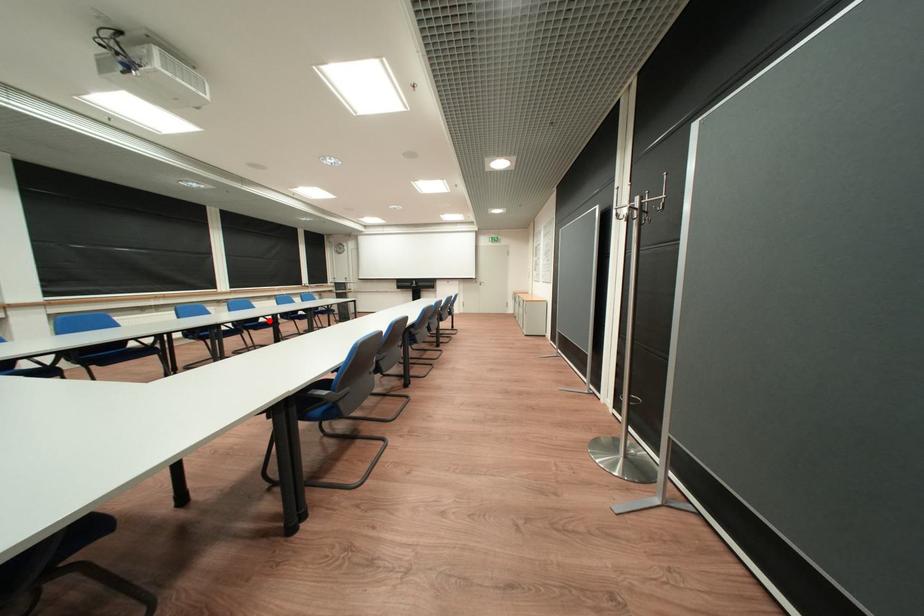
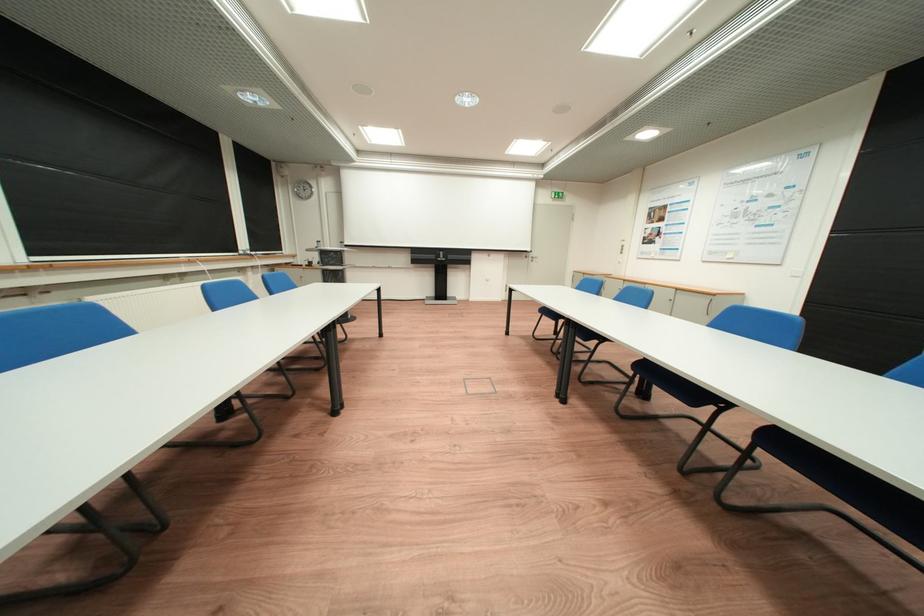
Question: I am providing you with two images of the same scene from different viewpoints. A red point is marked on the first image. Is the red point's position out of view in image 2?

Choices:
 (A) Yes
 (B) No

Answer: (A)